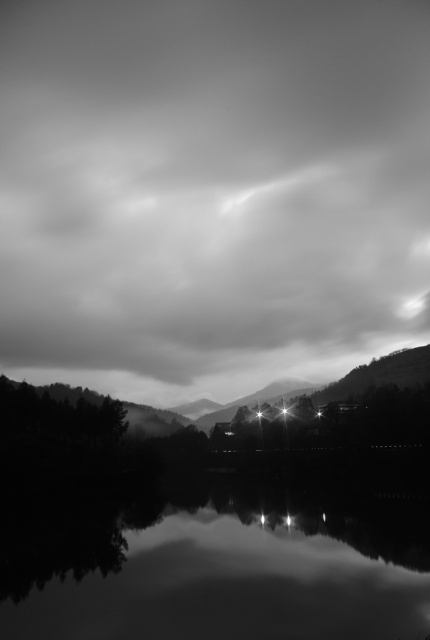
Consider the image. Based on the scene described, which object has a greater width between the cloudy sky at upper center and the smooth water at center?

The cloudy sky at upper center has a greater width than the smooth water at center according to the description.

Based on the scene described, which object is positioned higher in the image? The cloudy sky at upper center or the smooth water at center?

The cloudy sky at upper center is located above the smooth water at center, so it is positioned higher in the image.